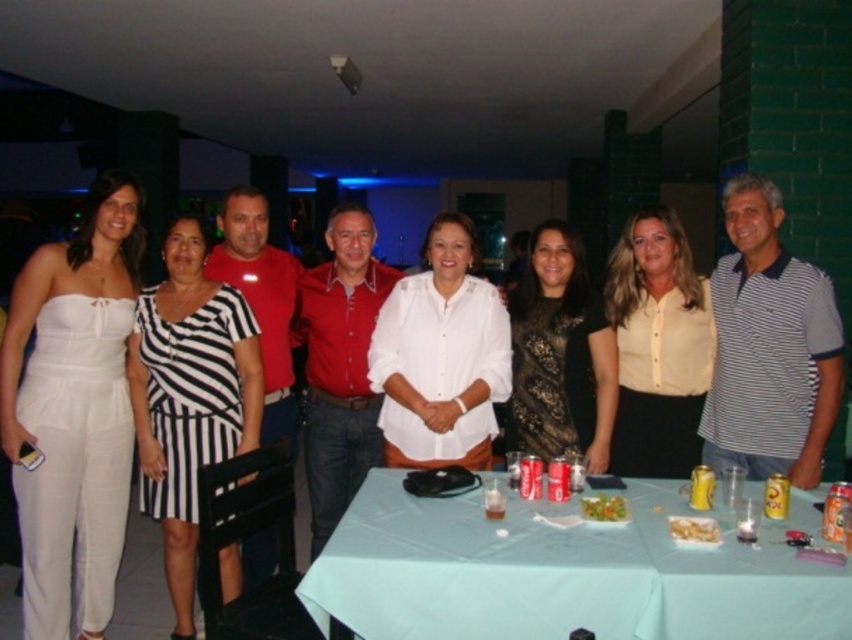
You are a photographer at a social event and need to adjust the lighting between the light blue fabric table at center and the striped polo shirt at right. Which object should you focus on first if you want to ensure the one closer to the camera is properly lit?

The striped polo shirt at right is closer to the camera than the light blue fabric table at center, so you should focus on lighting the striped polo shirt at right first.

You are standing in front of the group of eight adults at the social gathering. You notice two points marked in the image. The first point is at coordinate (458, 612) and the second is at coordinate (439, 228). Which point is closer to you?

Point (458, 612) is closer to the viewer than point (439, 228).